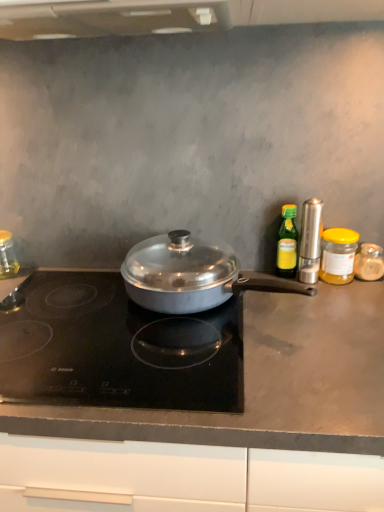
Identify the location of vacant space situated on the left part of translucent glass jar at right, which is counted as the 1th kitchen appliance, starting from the right. The height and width of the screenshot is (512, 384). (304, 297).